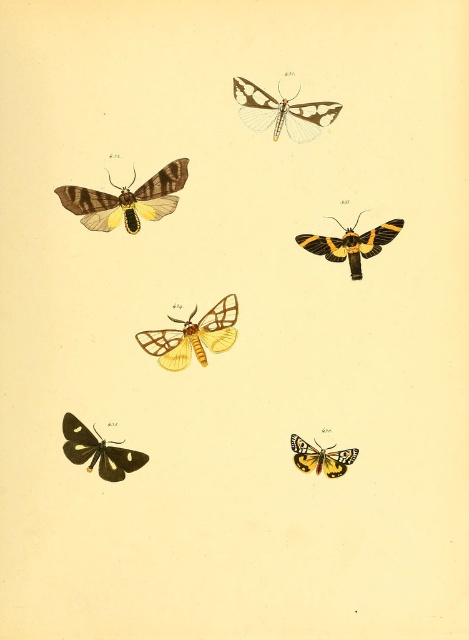
Is yellow-black moth at center thinner than yellow and black spotted butterfly at bottom right?

No.

Does yellow-black moth at center appear under yellow and black spotted butterfly at bottom right?

No, yellow-black moth at center is not below yellow and black spotted butterfly at bottom right.

Who is more distant from viewer, (307, 234) or (309, 468)?

The point (309, 468) is more distant.

The image size is (469, 640). I want to click on yellow-black moth at center, so click(350, 243).

Is matte yellow and black moth at upper left to the left of yellow matte butterfly at center from the viewer's perspective?

Correct, you'll find matte yellow and black moth at upper left to the left of yellow matte butterfly at center.

Does matte yellow and black moth at upper left have a larger size compared to yellow matte butterfly at center?

Yes, matte yellow and black moth at upper left is bigger than yellow matte butterfly at center.

Who is more distant from viewer, (x=90, y=192) or (x=173, y=369)?

The point (x=173, y=369) is behind.

Where is `matte yellow and black moth at upper left`? The width and height of the screenshot is (469, 640). matte yellow and black moth at upper left is located at coordinates (127, 198).

Is translucent white and black moth at upper center above yellow and black spotted butterfly at bottom right?

Yes.

Between point (252, 100) and point (319, 452), which one is positioned behind?

Point (319, 452)

Is point (317, 104) less distant than point (318, 452)?

That is True.

Where is `translucent white and black moth at upper center`? translucent white and black moth at upper center is located at coordinates (281, 112).